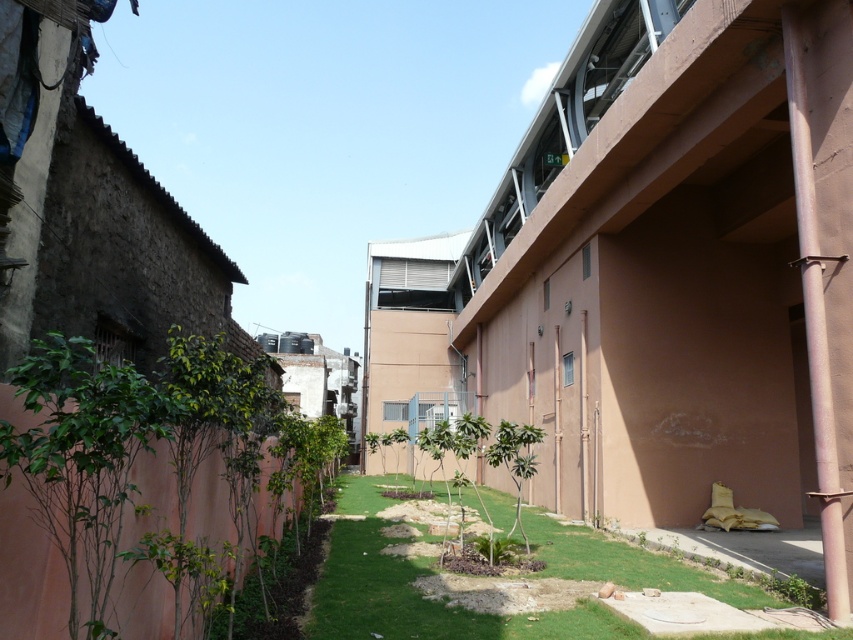
Which is above, green grass at center or brown concrete pipe at right?

brown concrete pipe at right is higher up.

Is point (555, 564) positioned in front of point (785, 28)?

That is False.

Is point (750, 584) positioned after point (787, 12)?

Yes, point (750, 584) is behind point (787, 12).

The height and width of the screenshot is (640, 853). I want to click on green grass at center, so click(x=416, y=589).